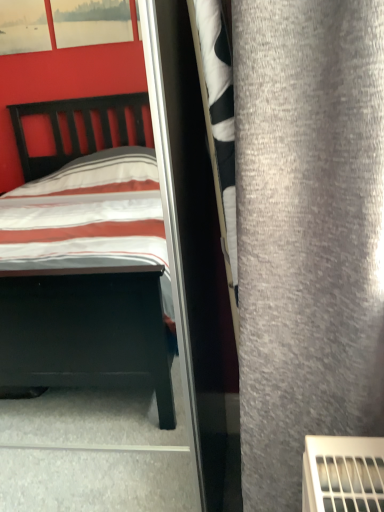
Question: Is clear glass screen door at center completely or partially inside striped fabric bed at left?

Choices:
 (A) yes
 (B) no

Answer: (B)

Question: From the image's perspective, would you say striped fabric bed at left is positioned over clear glass screen door at center?

Choices:
 (A) yes
 (B) no

Answer: (A)

Question: Can you confirm if striped fabric bed at left is shorter than clear glass screen door at center?

Choices:
 (A) no
 (B) yes

Answer: (A)

Question: From the image's perspective, is striped fabric bed at left located beneath clear glass screen door at center?

Choices:
 (A) yes
 (B) no

Answer: (B)

Question: Would you say striped fabric bed at left is outside clear glass screen door at center?

Choices:
 (A) no
 (B) yes

Answer: (B)

Question: Considering the relative positions of striped fabric bed at left and clear glass screen door at center in the image provided, is striped fabric bed at left to the left of clear glass screen door at center from the viewer's perspective?

Choices:
 (A) no
 (B) yes

Answer: (B)

Question: Does striped fabric bed at left have a lesser height compared to gray fabric curtain at right?

Choices:
 (A) no
 (B) yes

Answer: (A)

Question: Does striped fabric bed at left have a lesser width compared to gray fabric curtain at right?

Choices:
 (A) yes
 (B) no

Answer: (B)

Question: From the image's perspective, is striped fabric bed at left located beneath gray fabric curtain at right?

Choices:
 (A) no
 (B) yes

Answer: (B)

Question: Is striped fabric bed at left directly adjacent to gray fabric curtain at right?

Choices:
 (A) yes
 (B) no

Answer: (B)

Question: Can you confirm if striped fabric bed at left is positioned to the left of gray fabric curtain at right?

Choices:
 (A) yes
 (B) no

Answer: (A)

Question: Does striped fabric bed at left have a larger size compared to gray fabric curtain at right?

Choices:
 (A) no
 (B) yes

Answer: (B)

Question: Is gray fabric curtain at right outside of clear glass screen door at center?

Choices:
 (A) yes
 (B) no

Answer: (A)